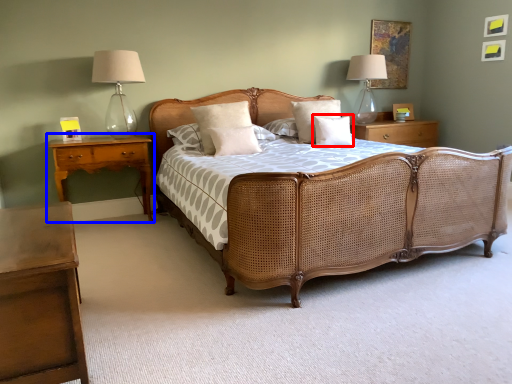
Question: Among these objects, which one is nearest to the camera, pillow (highlighted by a red box) or nightstand (highlighted by a blue box)?

Choices:
 (A) pillow
 (B) nightstand

Answer: (B)